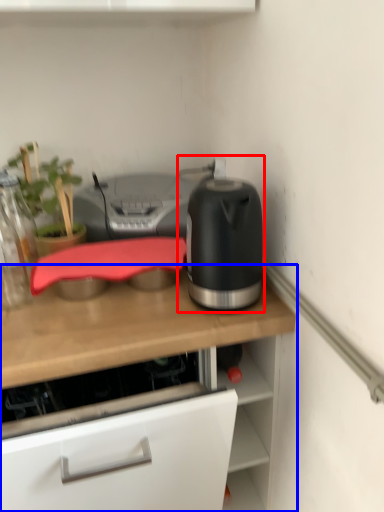
Question: Which of the following is the farthest to the observer, kitchen appliance (highlighted by a red box) or countertop (highlighted by a blue box)?

Choices:
 (A) kitchen appliance
 (B) countertop

Answer: (A)